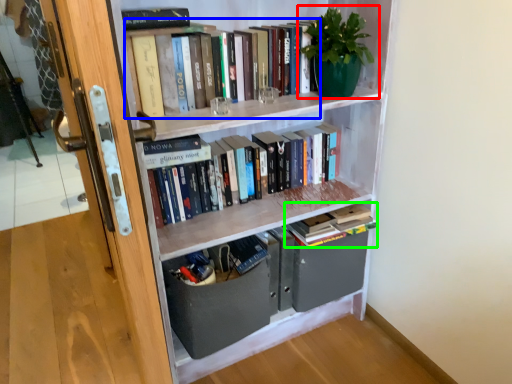
Question: Which is nearer to the houseplant (highlighted by a red box)? book (highlighted by a blue box) or book (highlighted by a green box).

Choices:
 (A) book
 (B) book

Answer: (A)